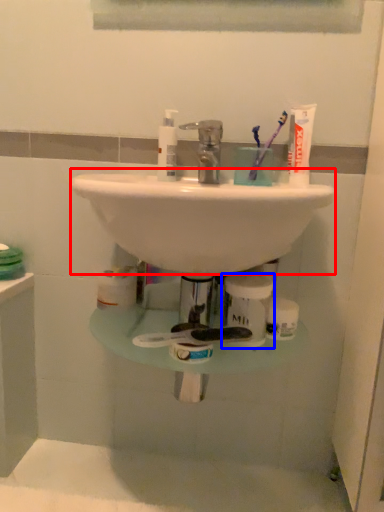
Question: Among these objects, which one is nearest to the camera, sink (highlighted by a red box) or toiletry (highlighted by a blue box)?

Choices:
 (A) sink
 (B) toiletry

Answer: (A)